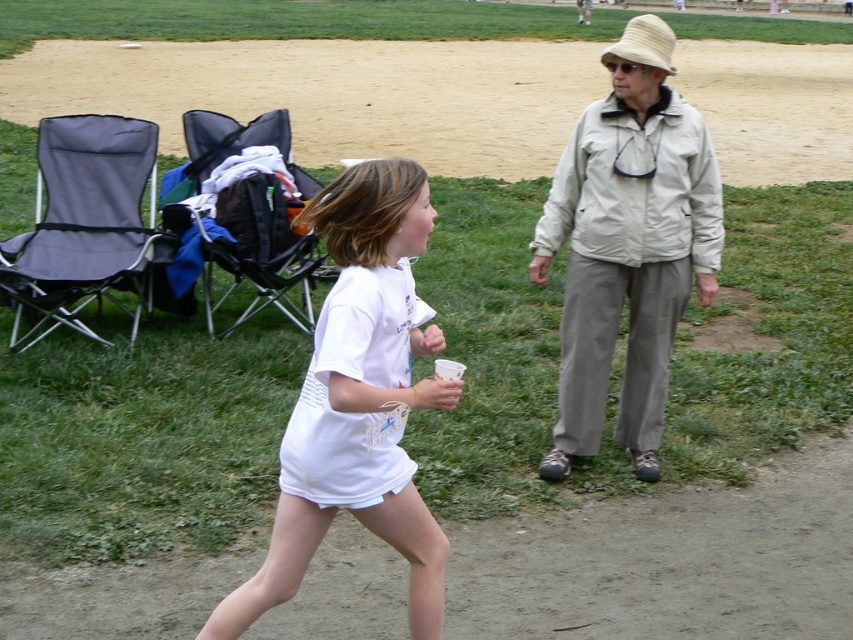
Is brown dirt track at lower center positioned before white matte shirt at center?

No, it is behind white matte shirt at center.

The image size is (853, 640). Identify the location of brown dirt track at lower center. (669, 560).

Is brown dirt track at center taller than white matte shirt at center?

Correct, brown dirt track at center is much taller as white matte shirt at center.

Looking at this image, does brown dirt track at center appear under white matte shirt at center?

No.

Identify the location of brown dirt track at center. The width and height of the screenshot is (853, 640). [x=334, y=93].

Locate an element on the screen. brown dirt track at center is located at coordinates (334, 93).

Which of these two, beige fabric jacket at center or black fabric baby carriage at left, stands taller?

beige fabric jacket at center is taller.

Image resolution: width=853 pixels, height=640 pixels. Describe the element at coordinates (628, 244) in the screenshot. I see `beige fabric jacket at center` at that location.

Where is `beige fabric jacket at center`? This screenshot has width=853, height=640. beige fabric jacket at center is located at coordinates (628, 244).